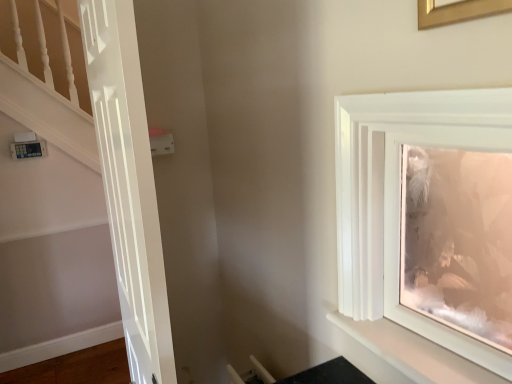
Question: Does white glossy shelf at upper right appear on the right side of white plastic light switch at upper center?

Choices:
 (A) no
 (B) yes

Answer: (B)

Question: Does white glossy shelf at upper right have a larger size compared to white plastic light switch at upper center?

Choices:
 (A) yes
 (B) no

Answer: (A)

Question: Can you see white glossy shelf at upper right touching white plastic light switch at upper center?

Choices:
 (A) no
 (B) yes

Answer: (A)

Question: From the image's perspective, does white glossy shelf at upper right appear lower than white plastic light switch at upper center?

Choices:
 (A) yes
 (B) no

Answer: (A)

Question: Is white glossy shelf at upper right taller than white plastic light switch at upper center?

Choices:
 (A) yes
 (B) no

Answer: (B)

Question: Based on their positions, is white plastic light switch at upper center located to the left or right of matte white picture frame at upper right, placed as the 2th picture frame when sorted from top to bottom?

Choices:
 (A) right
 (B) left

Answer: (B)

Question: Do you think white plastic light switch at upper center is within matte white picture frame at upper right, the first picture frame in the back-to-front sequence, or outside of it?

Choices:
 (A) inside
 (B) outside

Answer: (B)

Question: Based on their sizes in the image, would you say white plastic light switch at upper center is bigger or smaller than matte white picture frame at upper right, placed as the 2th picture frame when sorted from top to bottom?

Choices:
 (A) big
 (B) small

Answer: (B)

Question: Is white plastic light switch at upper center wider or thinner than matte white picture frame at upper right, arranged as the first picture frame when ordered from the bottom?

Choices:
 (A) wide
 (B) thin

Answer: (B)

Question: In terms of width, does matte white picture frame at upper right, arranged as the first picture frame when ordered from the bottom, look wider or thinner when compared to white glossy frame at upper right?

Choices:
 (A) thin
 (B) wide

Answer: (A)

Question: Do you think matte white picture frame at upper right, placed as the 2th picture frame when sorted from top to bottom, is within white glossy frame at upper right, or outside of it?

Choices:
 (A) inside
 (B) outside

Answer: (B)

Question: Considering their positions, is matte white picture frame at upper right, placed as the 2th picture frame when sorted from top to bottom, located in front of or behind white glossy frame at upper right?

Choices:
 (A) behind
 (B) front

Answer: (A)

Question: Does point (453, 190) appear closer or farther from the camera than point (384, 160)?

Choices:
 (A) closer
 (B) farther

Answer: (B)

Question: In terms of size, does white plastic light switch at upper center appear bigger or smaller than white glossy frame at upper right?

Choices:
 (A) big
 (B) small

Answer: (B)

Question: Is white plastic light switch at upper center in front of or behind white glossy frame at upper right in the image?

Choices:
 (A) behind
 (B) front

Answer: (A)